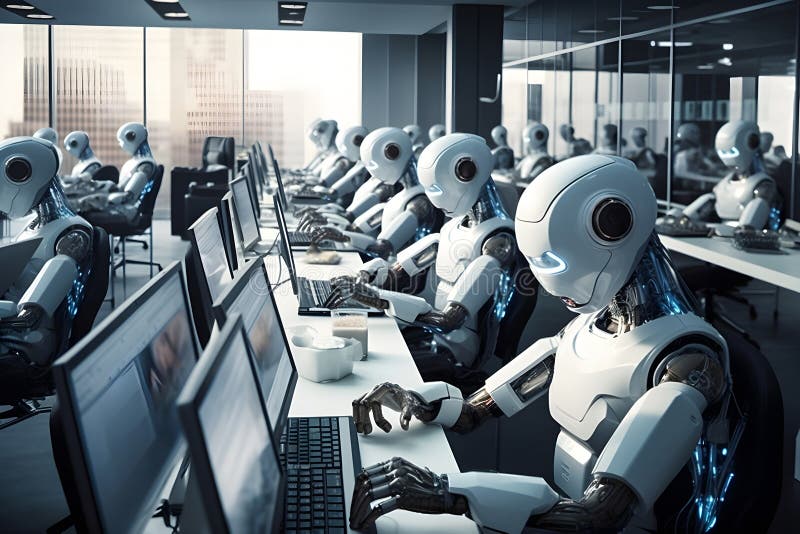
Identify the location of computer monitors. (110, 402), (208, 398), (281, 331), (218, 245), (249, 206), (284, 244), (281, 188), (274, 153), (262, 154), (258, 177).